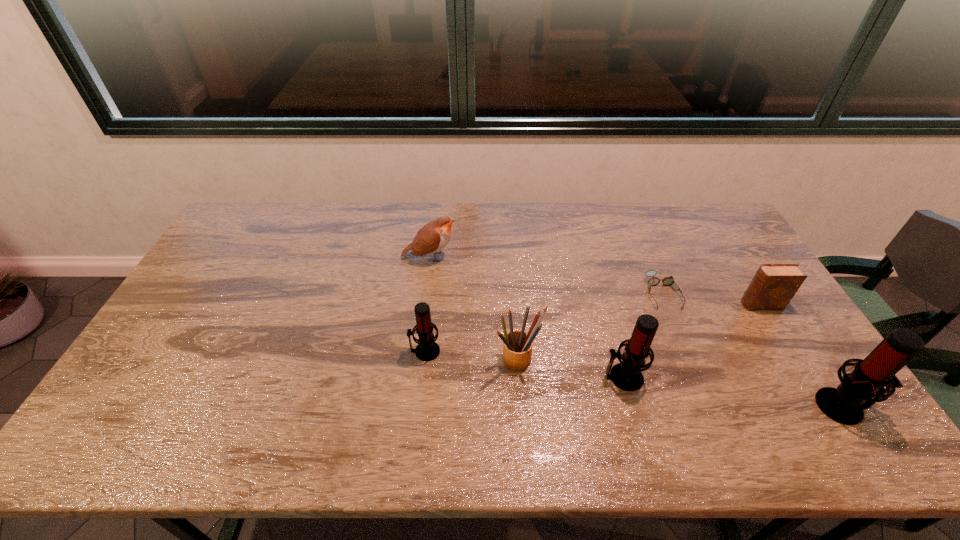
Identify which microphone is located as the nearest to the tallest microphone. Please provide its 2D coordinates. Your answer should be formatted as a tuple, i.e. [(x, y)], where the tuple contains the x and y coordinates of a point satisfying the conditions above.

[(626, 375)]

Locate an element on the screen. The width and height of the screenshot is (960, 540). blank space that satisfies the following two spatial constraints: 1. on the spine side of the diary; 2. on the front side of the shortest microphone is located at coordinates (789, 351).

Where is `blank area in the image that satisfies the following two spatial constraints: 1. on the front side of the tallest microphone; 2. on the right side of the fourth object from left to right`? Image resolution: width=960 pixels, height=540 pixels. blank area in the image that satisfies the following two spatial constraints: 1. on the front side of the tallest microphone; 2. on the right side of the fourth object from left to right is located at coordinates (631, 406).

Where is `vacant space that satisfies the following two spatial constraints: 1. on the front side of the fifth object from right to left; 2. on the left side of the rightmost microphone`? The height and width of the screenshot is (540, 960). vacant space that satisfies the following two spatial constraints: 1. on the front side of the fifth object from right to left; 2. on the left side of the rightmost microphone is located at coordinates (521, 406).

At what (x,y) coordinates should I click in order to perform the action: click on free region that satisfies the following two spatial constraints: 1. on the front side of the tallest object; 2. on the right side of the fourth object from left to right. Please return your answer as a coordinate pair (x, y). This screenshot has width=960, height=540. Looking at the image, I should click on (631, 406).

The image size is (960, 540). What are the coordinates of `vacant area in the image that satisfies the following two spatial constraints: 1. at the face of the shortest microphone; 2. on the left side of the bird` in the screenshot? It's located at pos(419,351).

Where is `free space that satisfies the following two spatial constraints: 1. at the face of the farthest object; 2. on the left side of the tallest object`? The image size is (960, 540). free space that satisfies the following two spatial constraints: 1. at the face of the farthest object; 2. on the left side of the tallest object is located at coordinates (412, 406).